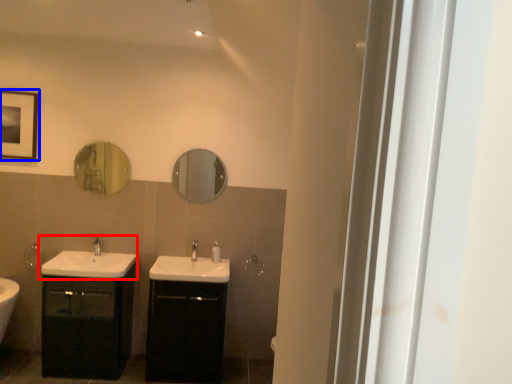
Question: Which object is closer to the camera taking this photo, sink (highlighted by a red box) or picture frame (highlighted by a blue box)?

Choices:
 (A) sink
 (B) picture frame

Answer: (A)